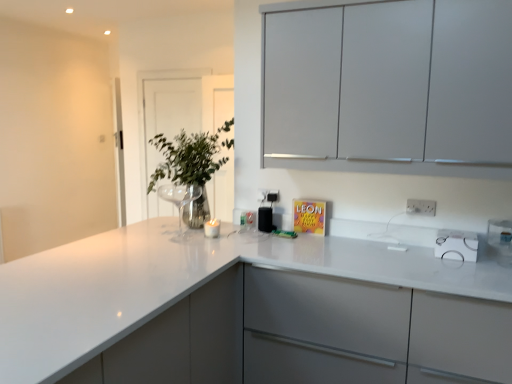
Question: Is metallic glass vase at center outside white glossy countertop at center?

Choices:
 (A) yes
 (B) no

Answer: (B)

Question: Can you confirm if metallic glass vase at center is thinner than white glossy countertop at center?

Choices:
 (A) no
 (B) yes

Answer: (B)

Question: Is white glossy countertop at center surrounded by metallic glass vase at center?

Choices:
 (A) yes
 (B) no

Answer: (B)

Question: From a real-world perspective, is metallic glass vase at center over white glossy countertop at center?

Choices:
 (A) yes
 (B) no

Answer: (A)

Question: Considering the relative sizes of metallic glass vase at center and white glossy countertop at center in the image provided, is metallic glass vase at center taller than white glossy countertop at center?

Choices:
 (A) no
 (B) yes

Answer: (A)

Question: Is white plastic electric outlet at upper right, arranged as the 1th electric outlet when viewed from the right, bigger or smaller than transparent glass door at upper center?

Choices:
 (A) big
 (B) small

Answer: (B)

Question: Is white plastic electric outlet at upper right, which is the 2th electric outlet in back-to-front order, to the left or to the right of transparent glass door at upper center in the image?

Choices:
 (A) left
 (B) right

Answer: (B)

Question: From the image's perspective, is white plastic electric outlet at upper right, positioned as the 2th electric outlet in left-to-right order, located above or below transparent glass door at upper center?

Choices:
 (A) above
 (B) below

Answer: (B)

Question: Is point (433, 208) positioned closer to the camera than point (145, 94)?

Choices:
 (A) closer
 (B) farther

Answer: (A)

Question: From the image's perspective, relative to black plastic speaker at center, is transparent glass door at upper center above or below?

Choices:
 (A) below
 (B) above

Answer: (B)

Question: Would you say transparent glass door at upper center is to the left or to the right of black plastic speaker at center in the picture?

Choices:
 (A) right
 (B) left

Answer: (B)

Question: Is transparent glass door at upper center taller or shorter than black plastic speaker at center?

Choices:
 (A) short
 (B) tall

Answer: (B)

Question: Is point (189, 117) positioned closer to the camera than point (259, 220)?

Choices:
 (A) farther
 (B) closer

Answer: (A)

Question: Looking at their shapes, would you say clear glass vase at upper left is wider or thinner than white glossy countertop at center?

Choices:
 (A) thin
 (B) wide

Answer: (A)

Question: Is clear glass vase at upper left to the left or to the right of white glossy countertop at center in the image?

Choices:
 (A) right
 (B) left

Answer: (B)